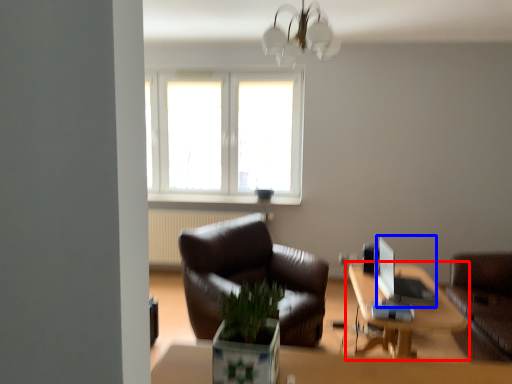
Question: Which point is further to the camera, table (highlighted by a red box) or computer (highlighted by a blue box)?

Choices:
 (A) table
 (B) computer

Answer: (B)